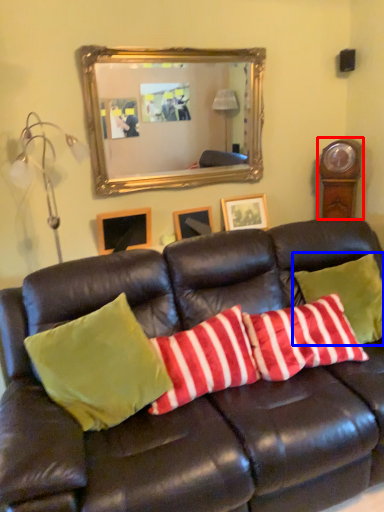
Question: Which of the following is the farthest to the observer, clock (highlighted by a red box) or pillow (highlighted by a blue box)?

Choices:
 (A) clock
 (B) pillow

Answer: (A)